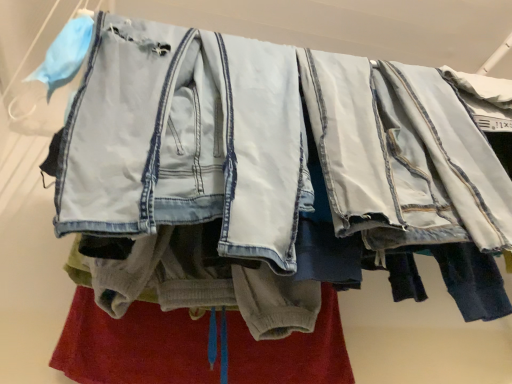
Question: Choose the correct answer: Is soft gray fleece pants at center inside light blue denim jacket at center or outside it?

Choices:
 (A) outside
 (B) inside

Answer: (A)

Question: Is soft gray fleece pants at center taller or shorter than light blue denim jacket at center?

Choices:
 (A) short
 (B) tall

Answer: (A)

Question: From the image's perspective, is soft gray fleece pants at center above or below light blue denim jacket at center?

Choices:
 (A) above
 (B) below

Answer: (B)

Question: In terms of width, does light blue denim jacket at center look wider or thinner when compared to soft gray fleece pants at center?

Choices:
 (A) wide
 (B) thin

Answer: (A)

Question: Would you say light blue denim jacket at center is to the left or to the right of soft gray fleece pants at center in the picture?

Choices:
 (A) right
 (B) left

Answer: (B)

Question: From the image's perspective, relative to soft gray fleece pants at center, is light blue denim jacket at center above or below?

Choices:
 (A) above
 (B) below

Answer: (A)

Question: Which is correct: light blue denim jacket at center is inside soft gray fleece pants at center, or outside of it?

Choices:
 (A) inside
 (B) outside

Answer: (B)